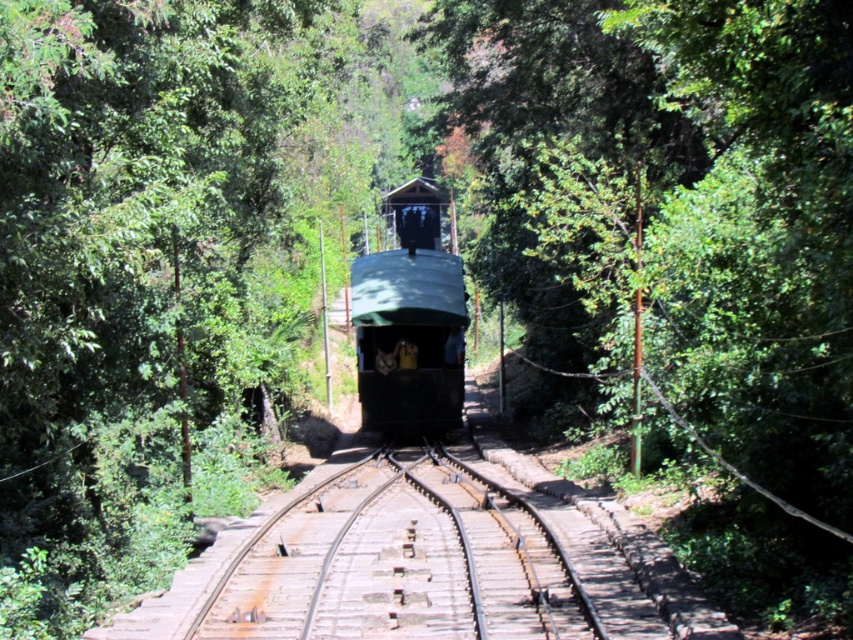
Question: Is rusty metal train track at center to the right of green matte train at center from the viewer's perspective?

Choices:
 (A) yes
 (B) no

Answer: (B)

Question: Which of the following is the farthest from the observer?

Choices:
 (A) green matte train at center
 (B) rusty metal train track at center

Answer: (A)

Question: In this image, where is rusty metal train track at center located relative to green matte train at center?

Choices:
 (A) right
 (B) left

Answer: (B)

Question: Among these points, which one is farthest from the camera?

Choices:
 (A) (425, 378)
 (B) (479, 593)

Answer: (A)

Question: Is rusty metal train track at center thinner than green matte train at center?

Choices:
 (A) yes
 (B) no

Answer: (B)

Question: Which point is closer to the camera?

Choices:
 (A) rusty metal train track at center
 (B) green matte train at center

Answer: (A)